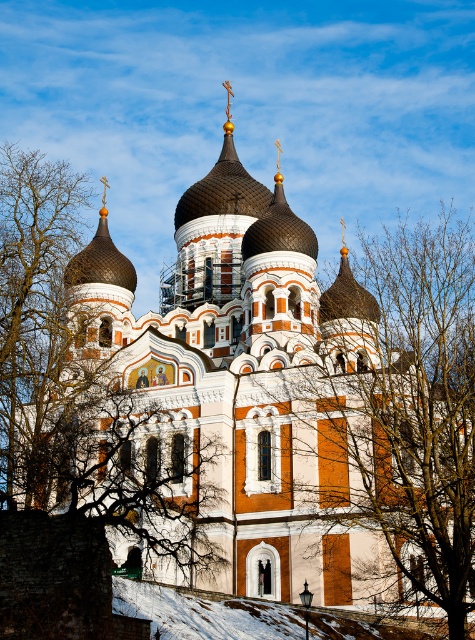
Between bare branches at center and matte brown dome at upper left, which one is positioned higher?

matte brown dome at upper left is above.

Is bare branches at center shorter than matte brown dome at upper left?

Incorrect, bare branches at center's height does not fall short of matte brown dome at upper left's.

Is point (371, 497) farther from viewer compared to point (114, 252)?

No, it is not.

Where is `bare branches at center`? Image resolution: width=475 pixels, height=640 pixels. bare branches at center is located at coordinates (418, 408).

Is point (191, 364) farther from viewer compared to point (182, 525)?

Yes, it is behind point (182, 525).

Who is shorter, white stone church at center or brown leafless branches at center?

brown leafless branches at center is shorter.

Who is more forward, [255,573] or [59,394]?

Point [255,573]

This screenshot has width=475, height=640. Identify the location of white stone church at center. (246, 387).

Does white stone church at center appear on the left side of bare branches at center?

Correct, you'll find white stone church at center to the left of bare branches at center.

Between point (306, 500) and point (426, 339), which one is positioned in front?

Point (306, 500)

Is point (315, 392) farther from viewer compared to point (404, 541)?

Yes, it is behind point (404, 541).

What are the coordinates of `white stone church at center` in the screenshot? It's located at (246, 387).